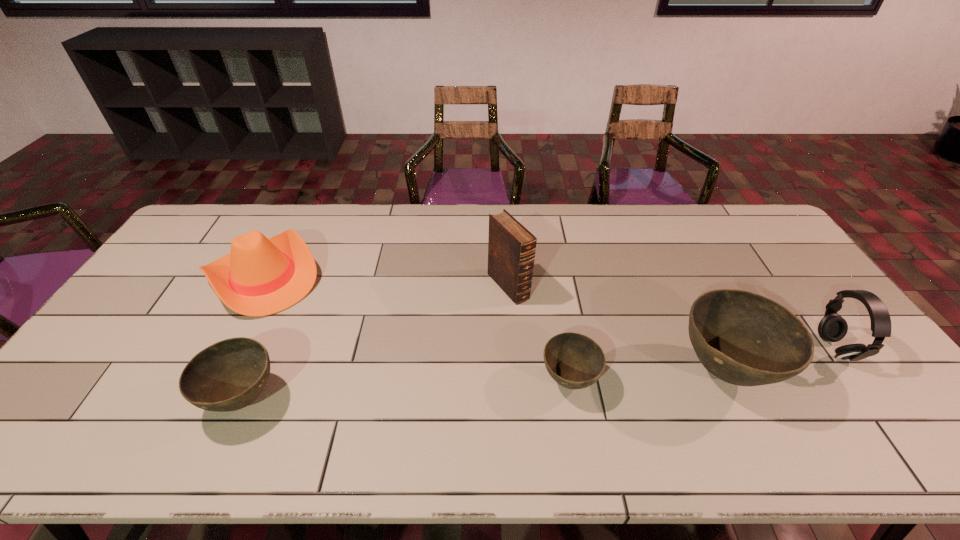
Locate an element on the screen. The height and width of the screenshot is (540, 960). free space located on the left of the second shortest bowl is located at coordinates (99, 399).

What are the coordinates of `blank area located on the back of the third object from right to left` in the screenshot? It's located at (556, 305).

What are the coordinates of `vacant area situated 0.300m on the back of the tallest bowl` in the screenshot? It's located at (670, 262).

I want to click on free spot located on the right of the cowboy hat, so click(374, 276).

Image resolution: width=960 pixels, height=540 pixels. Find the location of `vacant region located 0.240m on the left of the tallest object`. vacant region located 0.240m on the left of the tallest object is located at coordinates (410, 286).

This screenshot has width=960, height=540. I want to click on free spot located 0.110m on the ear cups of the earphone, so click(x=780, y=348).

This screenshot has height=540, width=960. I want to click on vacant region located 0.350m on the ear cups of the earphone, so click(690, 348).

Locate an element on the screen. free point located on the ear cups of the earphone is located at coordinates (705, 348).

The image size is (960, 540). Find the location of `object that is positioned at the far edge`. object that is positioned at the far edge is located at coordinates tap(262, 276).

Locate an element on the screen. The height and width of the screenshot is (540, 960). object situated at the right edge is located at coordinates (832, 327).